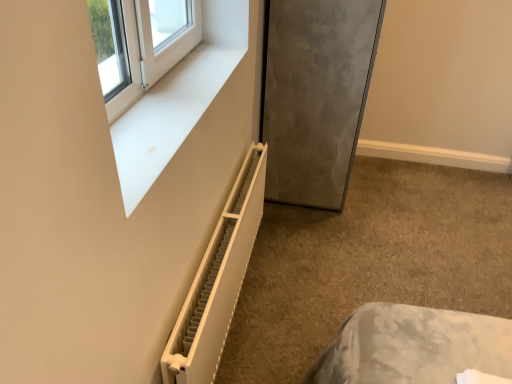
Question: From the image's perspective, is white plastic window frame at upper left under white matte radiator at lower left?

Choices:
 (A) no
 (B) yes

Answer: (A)

Question: Is white plastic window frame at upper left looking in the opposite direction of white matte radiator at lower left?

Choices:
 (A) yes
 (B) no

Answer: (B)

Question: Can you confirm if white plastic window frame at upper left is shorter than white matte radiator at lower left?

Choices:
 (A) yes
 (B) no

Answer: (A)

Question: Could white matte radiator at lower left be considered to be inside white plastic window frame at upper left?

Choices:
 (A) no
 (B) yes

Answer: (A)

Question: Is white plastic window frame at upper left further to camera compared to white matte radiator at lower left?

Choices:
 (A) no
 (B) yes

Answer: (A)

Question: From the image's perspective, is white matte radiator at lower left positioned above or below white plastic window frame at upper left?

Choices:
 (A) above
 (B) below

Answer: (B)

Question: Considering the positions of point (326, 306) and point (119, 102), is point (326, 306) closer or farther from the camera than point (119, 102)?

Choices:
 (A) farther
 (B) closer

Answer: (A)

Question: Is white matte radiator at lower left spatially inside white plastic window frame at upper left, or outside of it?

Choices:
 (A) inside
 (B) outside

Answer: (B)

Question: Visually, is white matte radiator at lower left positioned to the left or to the right of white plastic window frame at upper left?

Choices:
 (A) right
 (B) left

Answer: (A)

Question: Which is correct: satin gray refrigerator at lower right is inside white plastic radiator at lower left, or outside of it?

Choices:
 (A) outside
 (B) inside

Answer: (A)

Question: From a real-world perspective, relative to white plastic radiator at lower left, is satin gray refrigerator at lower right vertically above or below?

Choices:
 (A) above
 (B) below

Answer: (A)

Question: Is satin gray refrigerator at lower right bigger or smaller than white plastic radiator at lower left?

Choices:
 (A) big
 (B) small

Answer: (A)

Question: Is satin gray refrigerator at lower right in front of or behind white plastic radiator at lower left in the image?

Choices:
 (A) behind
 (B) front

Answer: (A)

Question: Based on their positions, is white matte radiator at lower left located to the left or right of satin gray refrigerator at lower right?

Choices:
 (A) left
 (B) right

Answer: (B)

Question: From the image's perspective, relative to satin gray refrigerator at lower right, is white matte radiator at lower left above or below?

Choices:
 (A) above
 (B) below

Answer: (B)